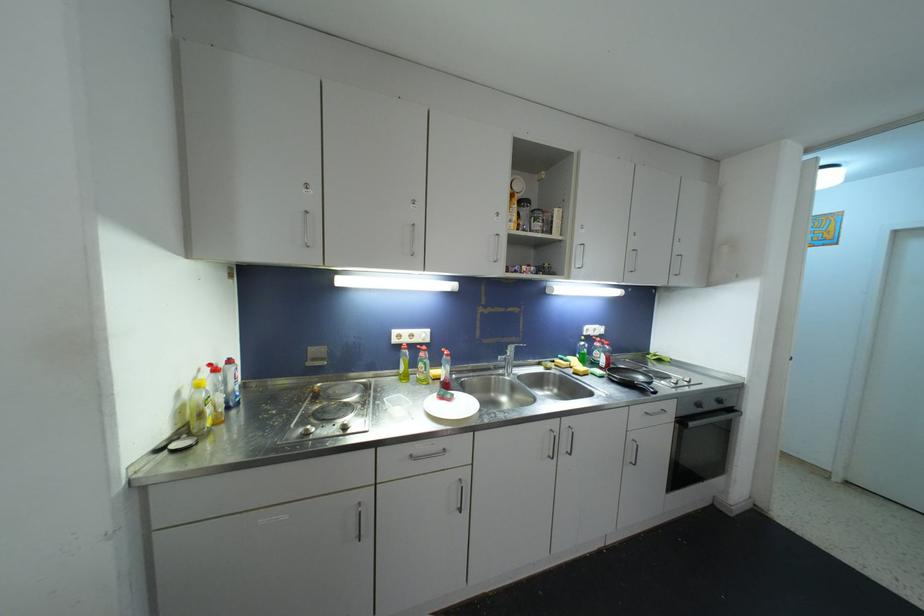
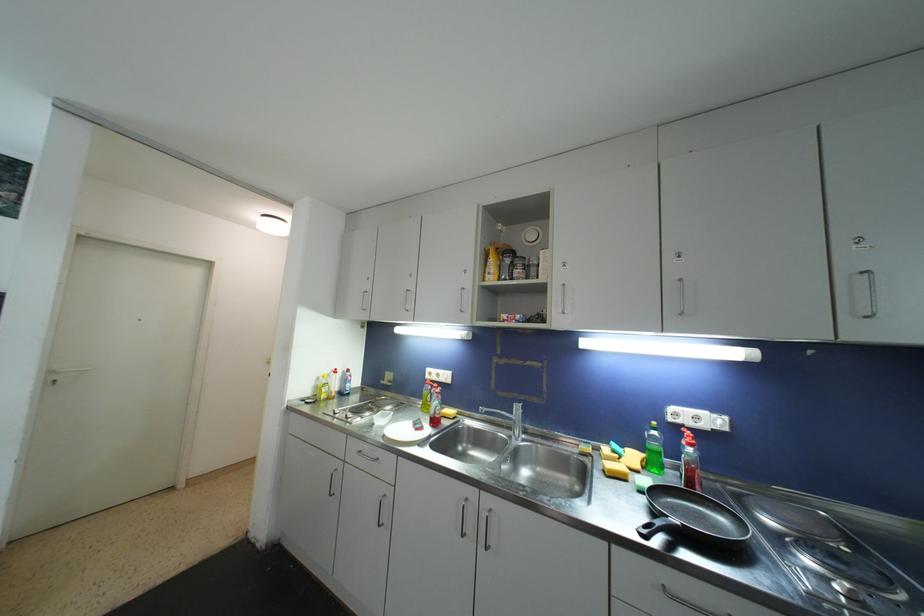
Locate, in the second image, the point that corresponds to (586,346) in the first image.

(658, 436)